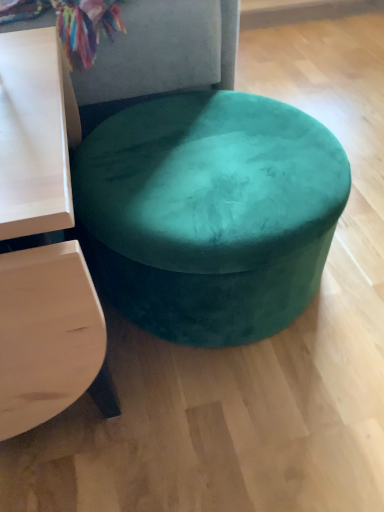
The height and width of the screenshot is (512, 384). What do you see at coordinates (210, 213) in the screenshot?
I see `teal velvet ottoman at center` at bounding box center [210, 213].

You are a GUI agent. You are given a task and a screenshot of the screen. Output one action in this format:
    pyautogui.click(x=<x>, y=<y>)
    Task: Click on the teal velvet ottoman at center
    The width and height of the screenshot is (384, 512).
    Given the screenshot: What is the action you would take?
    pyautogui.click(x=210, y=213)

The image size is (384, 512). Describe the element at coordinates (46, 334) in the screenshot. I see `matte white table at left` at that location.

You are a GUI agent. You are given a task and a screenshot of the screen. Output one action in this format:
    pyautogui.click(x=<x>, y=<y>)
    Task: Click on the matte white table at left
    The height and width of the screenshot is (512, 384).
    Given the screenshot: What is the action you would take?
    pyautogui.click(x=46, y=334)

Identify the location of teal velvet ottoman at center. Image resolution: width=384 pixels, height=512 pixels. (210, 213).

Between teal velvet ottoman at center and matte white table at left, which one appears on the right side from the viewer's perspective?

From the viewer's perspective, teal velvet ottoman at center appears more on the right side.

Between teal velvet ottoman at center and matte white table at left, which one is positioned behind?

teal velvet ottoman at center is further from the camera.

Does point (265, 229) come closer to viewer compared to point (11, 428)?

No, it is not.

From the picture: From the image's perspective, is teal velvet ottoman at center under matte white table at left?

No, from the image's perspective, teal velvet ottoman at center is not beneath matte white table at left.

From a real-world perspective, who is located higher, teal velvet ottoman at center or matte white table at left?

From a 3D spatial view, matte white table at left is above.

Does teal velvet ottoman at center have a greater width compared to matte white table at left?

In fact, teal velvet ottoman at center might be narrower than matte white table at left.

Considering the relative sizes of teal velvet ottoman at center and matte white table at left in the image provided, is teal velvet ottoman at center shorter than matte white table at left?

Correct, teal velvet ottoman at center is not as tall as matte white table at left.

Which of these two, teal velvet ottoman at center or matte white table at left, is smaller?

Smaller between the two is matte white table at left.

Would you say teal velvet ottoman at center contains matte white table at left?

No.

Is there a large distance between teal velvet ottoman at center and matte white table at left?

They are positioned close to each other.

Is teal velvet ottoman at center oriented towards matte white table at left?

No, teal velvet ottoman at center is not oriented towards matte white table at left.

How many degrees apart are the facing directions of teal velvet ottoman at center and matte white table at left?

teal velvet ottoman at center and matte white table at left are facing 0.000745 degrees away from each other.

Find the location of `table that is on the left side of teal velvet ottoman at center`. table that is on the left side of teal velvet ottoman at center is located at coordinates (46, 334).

Which is more to the right, matte white table at left or teal velvet ottoman at center?

teal velvet ottoman at center.

Considering the positions of objects matte white table at left and teal velvet ottoman at center in the image provided, who is behind, matte white table at left or teal velvet ottoman at center?

teal velvet ottoman at center is further from the camera.

Is point (37, 226) positioned before point (246, 134)?

That is True.

From the image's perspective, is matte white table at left on teal velvet ottoman at center?

No.

From a real-world perspective, who is located lower, matte white table at left or teal velvet ottoman at center?

teal velvet ottoman at center is physically lower.

Can you confirm if matte white table at left is wider than teal velvet ottoman at center?

Yes, matte white table at left is wider than teal velvet ottoman at center.

Between matte white table at left and teal velvet ottoman at center, which one has more height?

matte white table at left.

Considering the sizes of matte white table at left and teal velvet ottoman at center in the image, is matte white table at left bigger or smaller than teal velvet ottoman at center?

Clearly, matte white table at left is smaller in size than teal velvet ottoman at center.

Is matte white table at left not within teal velvet ottoman at center?

Yes, matte white table at left is outside of teal velvet ottoman at center.

Is matte white table at left in contact with teal velvet ottoman at center?

They are not placed beside each other.

Could you tell me if matte white table at left is facing teal velvet ottoman at center?

No, matte white table at left is not turned towards teal velvet ottoman at center.

This screenshot has width=384, height=512. What are the coordinates of `table above the teal velvet ottoman at center (from a real-world perspective)` in the screenshot? It's located at (46, 334).

I want to click on table located below the teal velvet ottoman at center (from the image's perspective), so click(46, 334).

Find the location of a particular element. The image size is (384, 512). stool that appears on the right of matte white table at left is located at coordinates (210, 213).